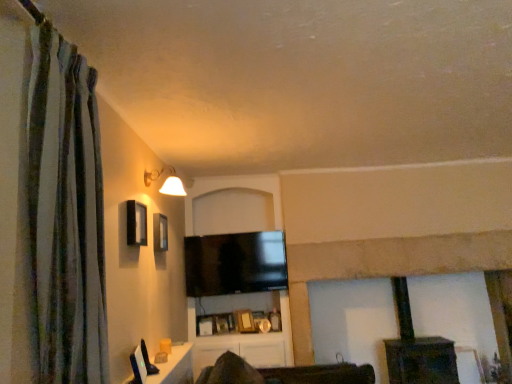
Locate an element on the screen. The width and height of the screenshot is (512, 384). free spot above flat screen tv at center (from a real-world perspective) is located at coordinates (231, 236).